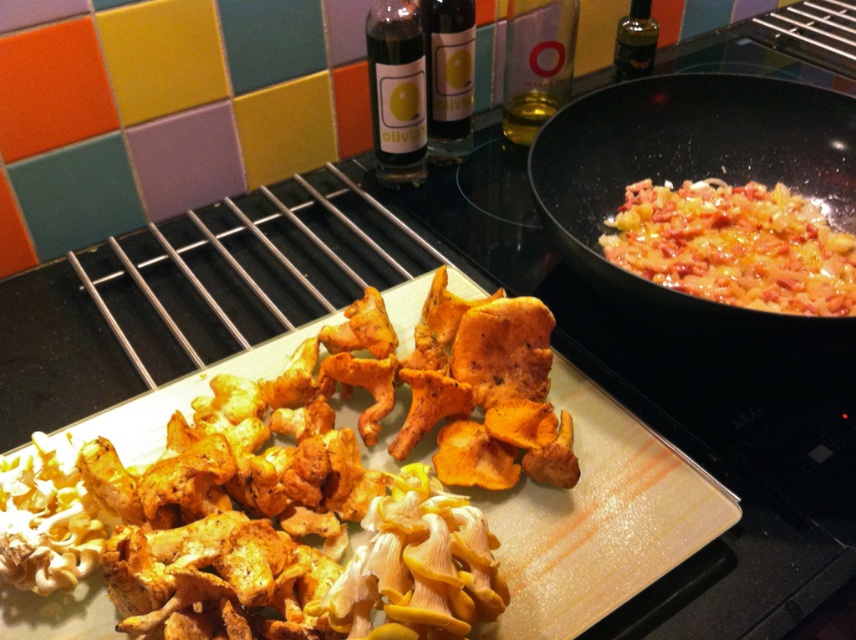
Question: Observing the image, what is the correct spatial positioning of shiny golden pasta at right in reference to transparent plastic bottle at upper right?

Choices:
 (A) above
 (B) below

Answer: (B)

Question: Which point appears closest to the camera in this image?

Choices:
 (A) (260, 547)
 (B) (535, 84)

Answer: (A)

Question: Which of the following is the closest to the observer?

Choices:
 (A) transparent plastic bottle at upper right
 (B) shiny golden pasta at right

Answer: (B)

Question: Considering the real-world distances, which object is farthest from the translucent glass bottle at center?

Choices:
 (A) black non-stick wok at right
 (B) transparent plastic bottle at upper right

Answer: (A)

Question: Is black non-stick wok at right to the left of translucent glass bottle at center from the viewer's perspective?

Choices:
 (A) no
 (B) yes

Answer: (A)

Question: Is yellowish-brown crispy mushrooms at center further to camera compared to transparent plastic bottle at upper right?

Choices:
 (A) yes
 (B) no

Answer: (B)